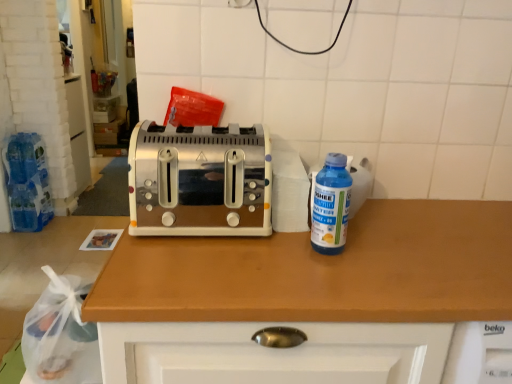
Image resolution: width=512 pixels, height=384 pixels. I want to click on vacant point to the left of blue plastic bottle at right, so click(x=246, y=252).